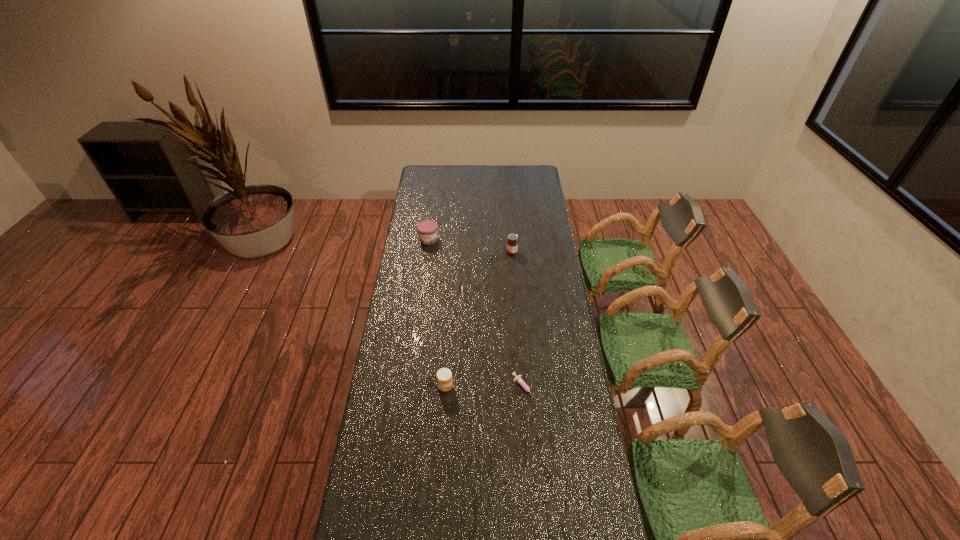
This screenshot has width=960, height=540. In order to click on the second farthest object in this screenshot , I will do `click(512, 244)`.

Find the location of `the rightmost jam`. the rightmost jam is located at coordinates (512, 244).

Identify the location of the farthest jam. (427, 230).

The width and height of the screenshot is (960, 540). I want to click on the leftmost object, so click(x=427, y=230).

Where is `the second object from left to right`? This screenshot has height=540, width=960. the second object from left to right is located at coordinates point(444,377).

This screenshot has width=960, height=540. Find the location of `the nearest jam`. the nearest jam is located at coordinates (444, 377).

I want to click on syringe, so click(x=518, y=378).

You are a GUI agent. You are given a task and a screenshot of the screen. Output one action in this format:
    pyautogui.click(x=<x>, y=<y>)
    Task: Click on the free space located on the label side of the third nearest object
    
    Given the screenshot: What is the action you would take?
    pyautogui.click(x=456, y=252)

The height and width of the screenshot is (540, 960). I want to click on vacant region located on the label side of the third nearest object, so click(441, 252).

Locate an element on the screen. Image resolution: width=960 pixels, height=540 pixels. free space located 0.250m on the label side of the third nearest object is located at coordinates (456, 252).